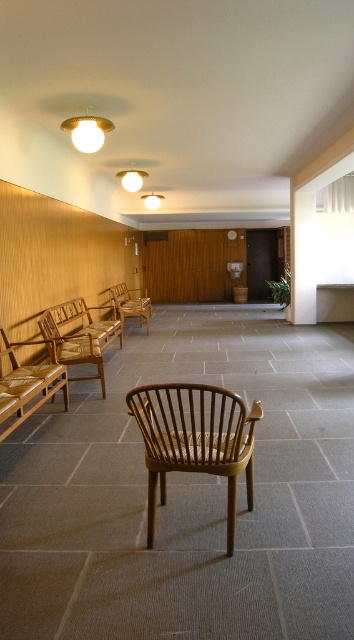
You are designing a seating arrangement in this space and need to place both the light brown wooden bench at left and the brown woven bench at left. Which bench should you choose if you want to accommodate more people?

The brown woven bench at left is larger in size, so it can accommodate more people compared to the light brown wooden bench at left.